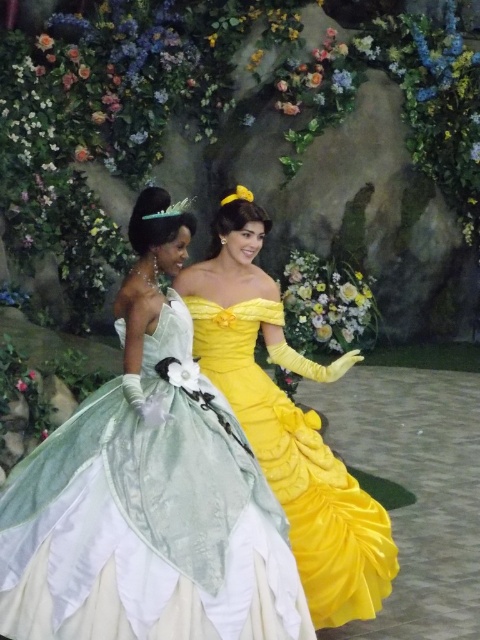
Question: Among these objects, which one is farthest from the camera?

Choices:
 (A) matte green gown at center
 (B) yellow satin dress at center

Answer: (B)

Question: Is matte green gown at center below yellow satin dress at center?

Choices:
 (A) yes
 (B) no

Answer: (B)

Question: Which of the following is the closest to the observer?

Choices:
 (A) matte green gown at center
 (B) yellow satin dress at center

Answer: (A)

Question: Is the position of matte green gown at center less distant than that of yellow satin dress at center?

Choices:
 (A) no
 (B) yes

Answer: (B)

Question: Which object appears closest to the camera in this image?

Choices:
 (A) matte green gown at center
 (B) yellow satin dress at center

Answer: (A)

Question: Is matte green gown at center wider than yellow satin dress at center?

Choices:
 (A) no
 (B) yes

Answer: (B)